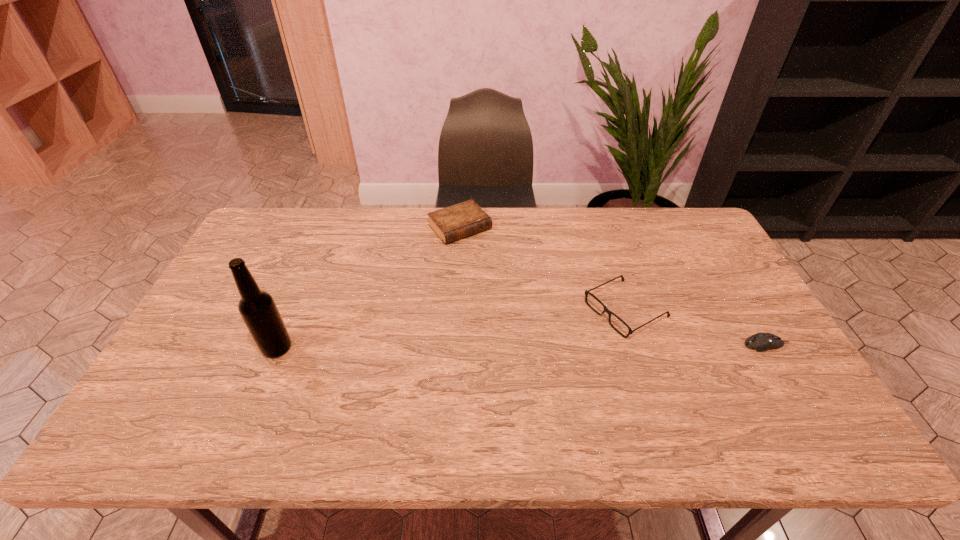
Where is `vacant area situated 0.350m on the front-facing side of the spectacles`? vacant area situated 0.350m on the front-facing side of the spectacles is located at coordinates (490, 384).

The height and width of the screenshot is (540, 960). Find the location of `vacant space situated on the front-facing side of the spectacles`. vacant space situated on the front-facing side of the spectacles is located at coordinates (510, 374).

Identify the location of vacant space located on the spine side of the farthest object. (538, 313).

At what (x,y) coordinates should I click in order to perform the action: click on free point located on the spine side of the farthest object. Please return your answer as a coordinate pair (x, y). The image size is (960, 540). Looking at the image, I should click on (524, 298).

You are a GUI agent. You are given a task and a screenshot of the screen. Output one action in this format:
    pyautogui.click(x=<x>, y=<y>)
    Task: Click on the vacant region located on the spine side of the farthest object
    
    Given the screenshot: What is the action you would take?
    pyautogui.click(x=524, y=298)

Find the location of a particular element. Image resolution: width=960 pixels, height=540 pixels. object positioned at the far edge is located at coordinates (458, 221).

Where is `object that is at the right edge`? object that is at the right edge is located at coordinates (761, 342).

This screenshot has height=540, width=960. I want to click on vacant region at the far edge, so click(x=644, y=217).

Locate an element on the screen. Image resolution: width=960 pixels, height=540 pixels. vacant space at the right edge of the desktop is located at coordinates (721, 342).

Image resolution: width=960 pixels, height=540 pixels. In the image, there is a desktop. Find the location of `vacant space at the far left corner`. vacant space at the far left corner is located at coordinates (266, 235).